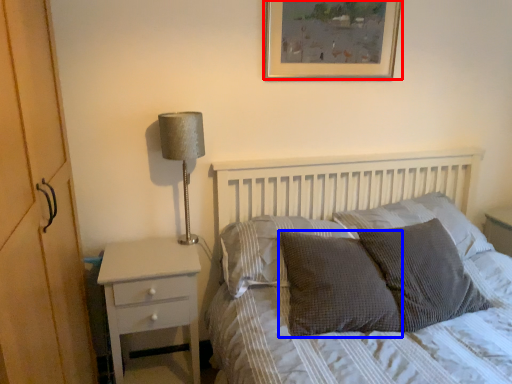
Question: Which point is closer to the camera, picture frame (highlighted by a red box) or pillow (highlighted by a blue box)?

Choices:
 (A) picture frame
 (B) pillow

Answer: (B)